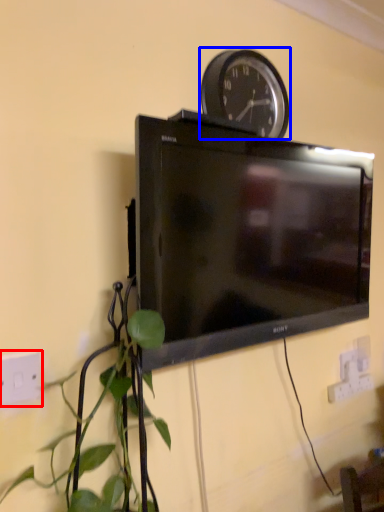
Question: Which point is closer to the camera, electric outlet (highlighted by a red box) or wall clock (highlighted by a blue box)?

Choices:
 (A) electric outlet
 (B) wall clock

Answer: (A)